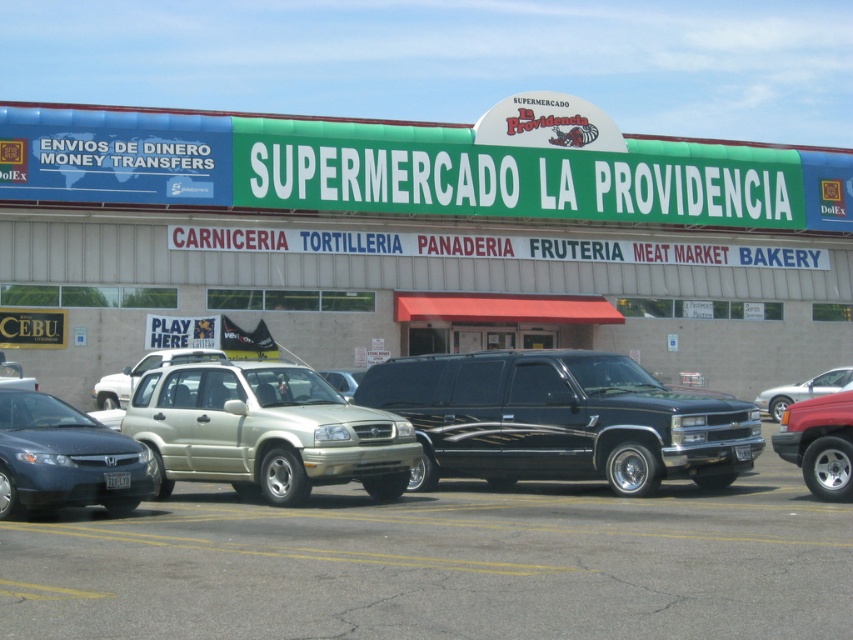
Does metallic silver suv at center lie in front of metallic gold suv at center?

That is True.

Does metallic silver suv at center have a larger size compared to metallic gold suv at center?

Yes, metallic silver suv at center is bigger than metallic gold suv at center.

What do you see at coordinates (440, 563) in the screenshot? The width and height of the screenshot is (853, 640). I see `metallic silver suv at center` at bounding box center [440, 563].

Locate an element on the screen. This screenshot has height=640, width=853. metallic silver suv at center is located at coordinates click(440, 563).

How far apart are metallic silver suv at center and matte gray sedan at lower left?

A distance of 8.42 feet exists between metallic silver suv at center and matte gray sedan at lower left.

Is metallic silver suv at center taller than matte gray sedan at lower left?

In fact, metallic silver suv at center may be shorter than matte gray sedan at lower left.

Which is in front, point (415, 531) or point (6, 493)?

Positioned in front is point (415, 531).

In order to click on metallic silver suv at center in this screenshot , I will do `click(440, 563)`.

What do you see at coordinates (265, 432) in the screenshot? I see `gold matte suv at center` at bounding box center [265, 432].

This screenshot has height=640, width=853. What are the coordinates of `gold matte suv at center` in the screenshot? It's located at (265, 432).